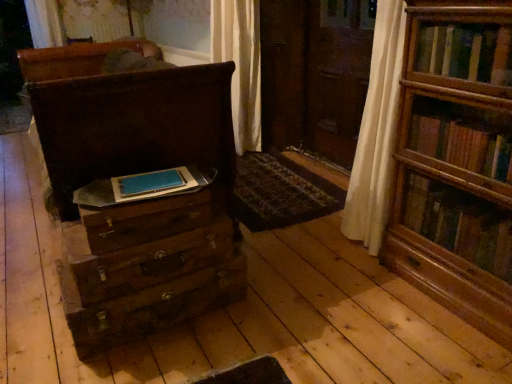
The width and height of the screenshot is (512, 384). Identify the location of vacant space underneath patterned carpet at center (from a real-world perspective). (276, 178).